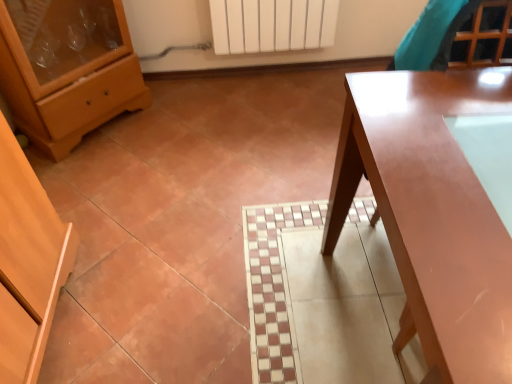
Image resolution: width=512 pixels, height=384 pixels. In order to click on space that is in front of matte wood chest of drawers at left in this screenshot , I will do `click(106, 176)`.